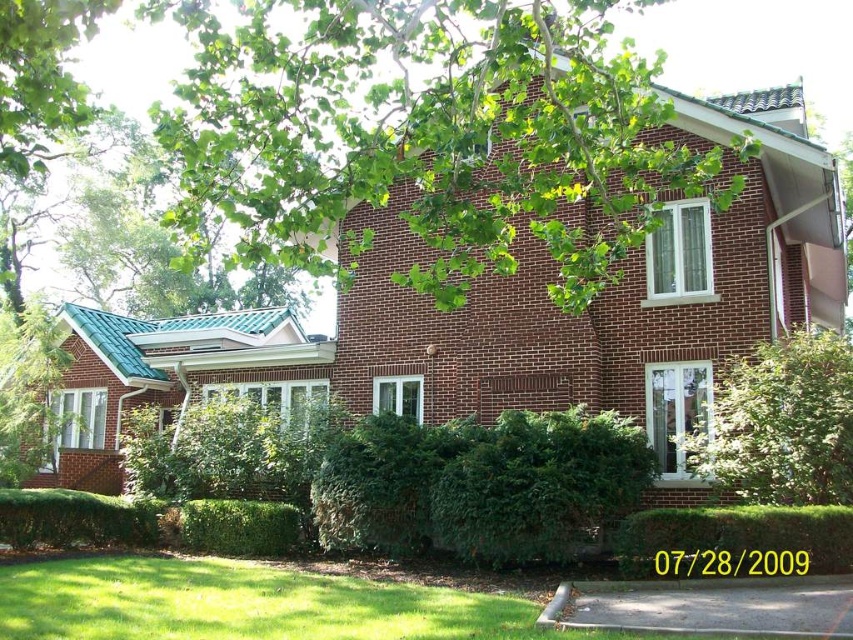
How far apart are green leafy tree at upper center and green leafy bush at center?

The distance of green leafy tree at upper center from green leafy bush at center is 4.83 meters.

Is green leafy tree at upper center to the right of green leafy bush at center from the viewer's perspective?

In fact, green leafy tree at upper center is to the left of green leafy bush at center.

Where is `green leafy tree at upper center`? The width and height of the screenshot is (853, 640). green leafy tree at upper center is located at coordinates (425, 132).

Locate an element on the screen. The image size is (853, 640). green leafy tree at upper center is located at coordinates (425, 132).

Looking at this image, can you confirm if green leafy bush at lower center is thinner than green leafy bush at center?

No.

Does green leafy bush at lower center have a smaller size compared to green leafy bush at center?

No.

Locate an element on the screen. green leafy bush at lower center is located at coordinates (538, 484).

I want to click on green leafy bush at lower center, so click(x=538, y=484).

Is the position of green leafy bush at lower center less distant than that of green leafy hedge at center?

No, green leafy bush at lower center is further to the viewer.

Who is more forward, (438,488) or (653,513)?

Point (653,513)

Locate an element on the screen. green leafy bush at lower center is located at coordinates (538, 484).